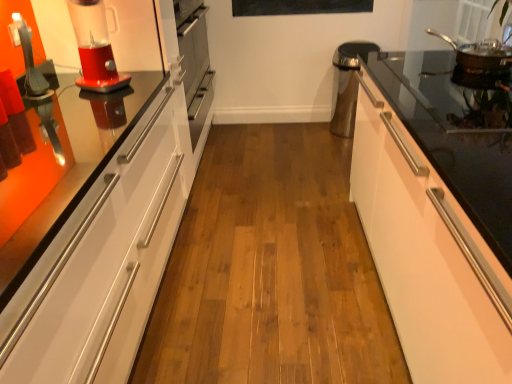
Question: Would you say white glossy cabinet at right is part of stainless steel frying pan at upper right's contents?

Choices:
 (A) yes
 (B) no

Answer: (B)

Question: From the image's perspective, is stainless steel frying pan at upper right located above white glossy cabinet at right?

Choices:
 (A) no
 (B) yes

Answer: (B)

Question: Is the depth of stainless steel frying pan at upper right less than that of white glossy cabinet at right?

Choices:
 (A) no
 (B) yes

Answer: (A)

Question: From the image's perspective, is stainless steel frying pan at upper right located beneath white glossy cabinet at right?

Choices:
 (A) yes
 (B) no

Answer: (B)

Question: Can we say stainless steel frying pan at upper right lies outside white glossy cabinet at right?

Choices:
 (A) no
 (B) yes

Answer: (B)

Question: Does point (261, 11) appear closer or farther from the camera than point (100, 54)?

Choices:
 (A) closer
 (B) farther

Answer: (B)

Question: Considering the positions of black matte bulletin board at upper center and translucent plastic blender at left in the image, is black matte bulletin board at upper center bigger or smaller than translucent plastic blender at left?

Choices:
 (A) small
 (B) big

Answer: (A)

Question: From the image's perspective, relative to translucent plastic blender at left, is black matte bulletin board at upper center above or below?

Choices:
 (A) above
 (B) below

Answer: (A)

Question: Would you say black matte bulletin board at upper center is to the left or to the right of translucent plastic blender at left in the picture?

Choices:
 (A) left
 (B) right

Answer: (B)

Question: Is white glossy cabinet at right in front of or behind stainless steel frying pan at upper right in the image?

Choices:
 (A) behind
 (B) front

Answer: (B)

Question: From the image's perspective, is white glossy cabinet at right located above or below stainless steel frying pan at upper right?

Choices:
 (A) below
 (B) above

Answer: (A)

Question: Looking at their shapes, would you say white glossy cabinet at right is wider or thinner than stainless steel frying pan at upper right?

Choices:
 (A) wide
 (B) thin

Answer: (A)

Question: From their relative heights in the image, would you say white glossy cabinet at right is taller or shorter than stainless steel frying pan at upper right?

Choices:
 (A) short
 (B) tall

Answer: (B)

Question: In terms of height, does stainless steel frying pan at upper right look taller or shorter compared to translucent plastic blender at left?

Choices:
 (A) short
 (B) tall

Answer: (A)

Question: Is stainless steel frying pan at upper right spatially inside translucent plastic blender at left, or outside of it?

Choices:
 (A) outside
 (B) inside

Answer: (A)